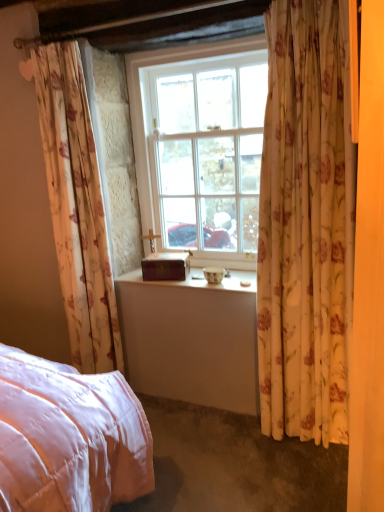
Identify the location of vacant region to the left of floral fabric curtain at right, the 1th curtain from the right. (252, 442).